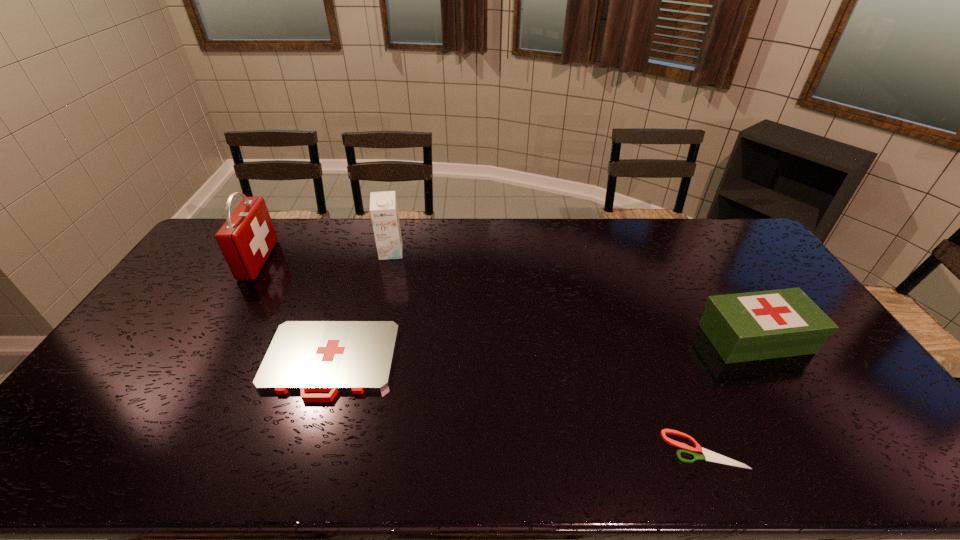
At what (x,y) coordinates should I click in order to perform the action: click on free location that satisfies the following two spatial constraints: 1. on the back side of the scissors; 2. on the front face of the leftmost object. Please return your answer as a coordinate pair (x, y). The image size is (960, 540). Looking at the image, I should click on (628, 260).

This screenshot has width=960, height=540. Identify the location of vacant region that satisfies the following two spatial constraints: 1. on the back side of the nearest object; 2. on the front face of the leftmost object. (628, 260).

At what (x,y) coordinates should I click in order to perform the action: click on free spot that satisfies the following two spatial constraints: 1. on the back side of the rightmost first-aid kit; 2. on the right side of the second object from right to left. Please return your answer as a coordinate pair (x, y). The image size is (960, 540). Looking at the image, I should click on (660, 339).